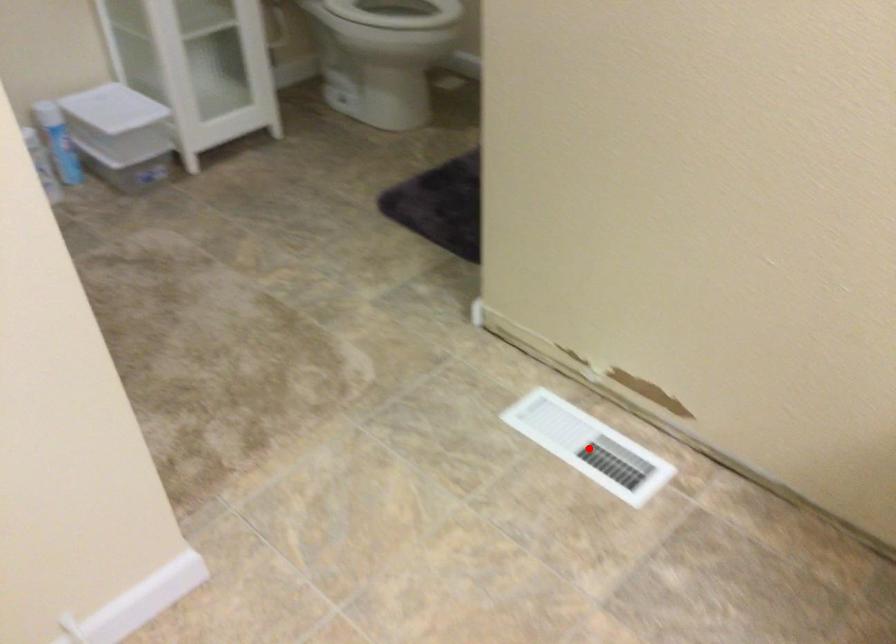
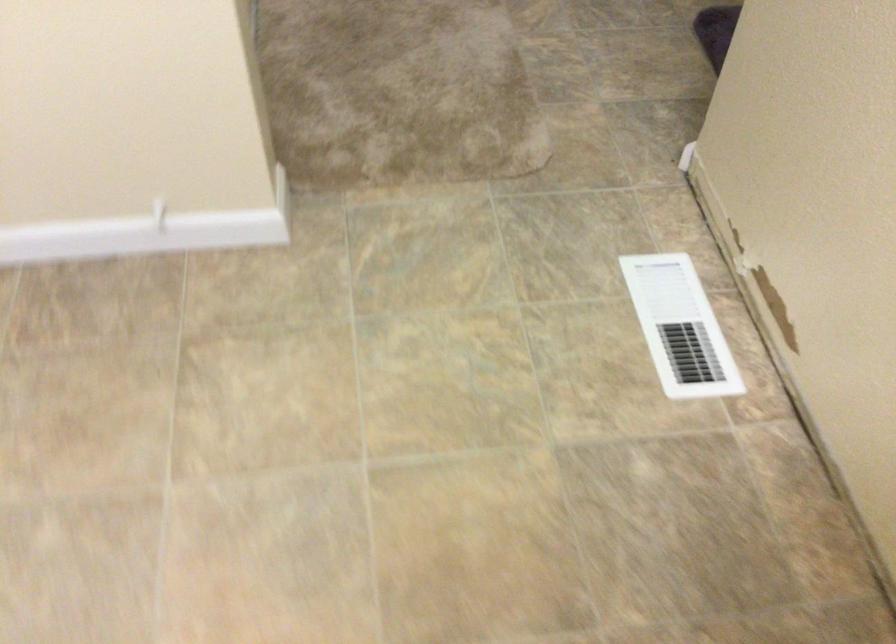
Question: I am providing you with two images of the same scene from different viewpoints. A red point is shown in image1. For the corresponding object point in image2, is it positioned nearer or farther from the camera?

Choices:
 (A) Nearer
 (B) Farther

Answer: (A)